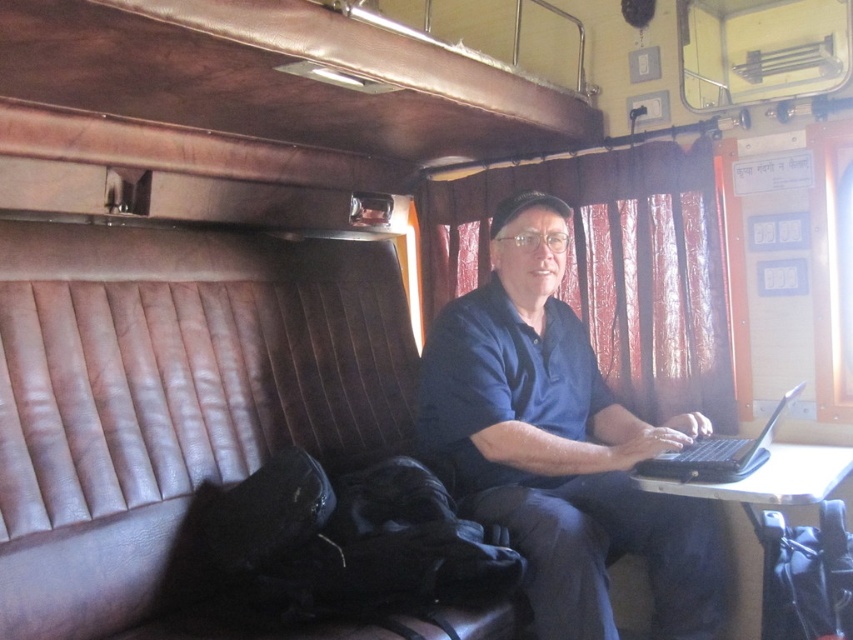
Question: Which is nearer to the blue fabric shirt at center?

Choices:
 (A) brown leather couch at center
 (B) black plastic laptop at center

Answer: (B)

Question: Does blue fabric shirt at center have a smaller size compared to black plastic laptop at center?

Choices:
 (A) yes
 (B) no

Answer: (B)

Question: Does blue fabric shirt at center appear under black plastic laptop at center?

Choices:
 (A) yes
 (B) no

Answer: (B)

Question: Can you confirm if blue fabric shirt at center is thinner than black plastic laptop at center?

Choices:
 (A) yes
 (B) no

Answer: (B)

Question: Among these objects, which one is farthest from the camera?

Choices:
 (A) blue fabric shirt at center
 (B) black plastic laptop at center
 (C) brown leather couch at center

Answer: (B)

Question: Which point is closer to the camera taking this photo?

Choices:
 (A) (718, 436)
 (B) (515, 532)
 (C) (109, 579)

Answer: (C)